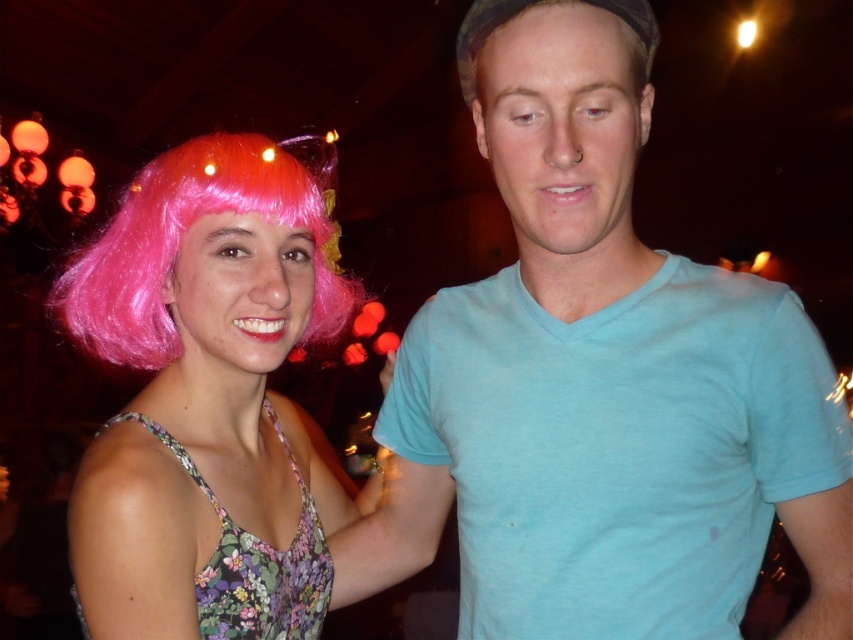
Question: In this image, where is pink wig at left located relative to brown matte hair at upper center?

Choices:
 (A) above
 (B) below

Answer: (B)

Question: Does pink wig at left appear on the left side of floral-patterned fabric dress at lower left?

Choices:
 (A) yes
 (B) no

Answer: (A)

Question: Which point is closer to the camera taking this photo?

Choices:
 (A) (651, 52)
 (B) (265, 563)
 (C) (314, 250)

Answer: (A)

Question: Where is light blue cotton t-shirt at center located in relation to pink matte wig at left in the image?

Choices:
 (A) above
 (B) below

Answer: (B)

Question: Among these points, which one is nearest to the camera?

Choices:
 (A) tap(282, 310)
 (B) tap(483, 307)

Answer: (A)

Question: Estimate the real-world distances between objects in this image. Which object is closer to the brown matte hair at upper center?

Choices:
 (A) light blue cotton t-shirt at center
 (B) pink wig at left
 (C) pink matte wig at left

Answer: (A)